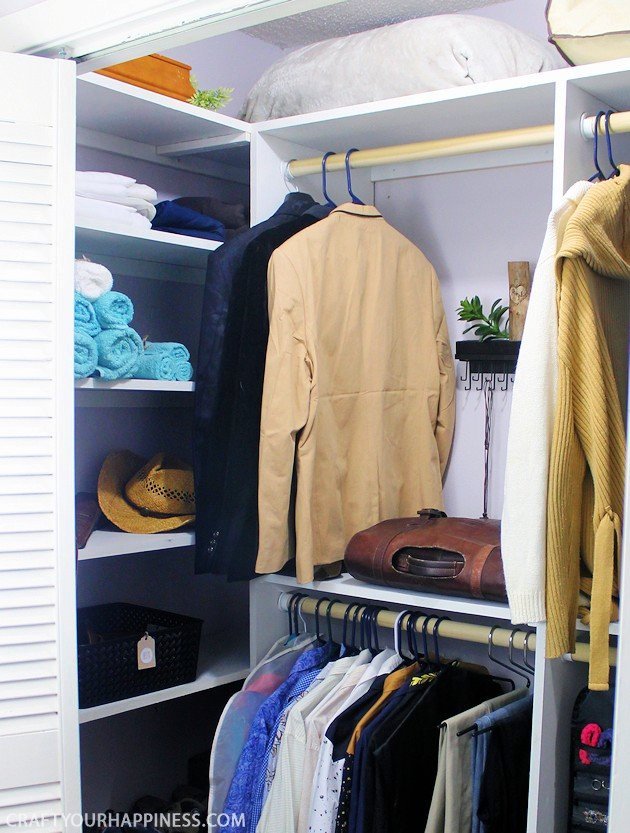
At what (x,y) coordinates should I click in order to perform the action: click on silver colored hooks on hangers. Please return your answer as a coordinate pair (x, y). This screenshot has width=630, height=833. Looking at the image, I should click on (488, 631), (508, 635), (522, 637).